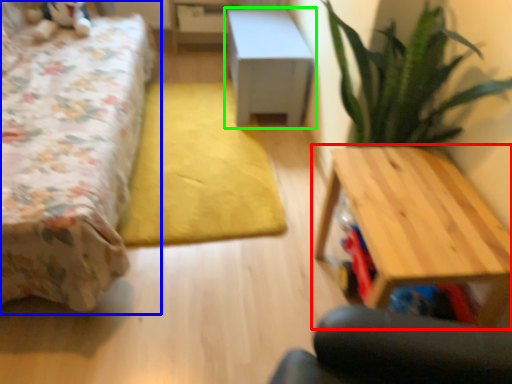
Question: Which object is the farthest from table (highlighted by a red box)? Choose among these: bed (highlighted by a blue box) or table (highlighted by a green box).

Choices:
 (A) bed
 (B) table

Answer: (B)